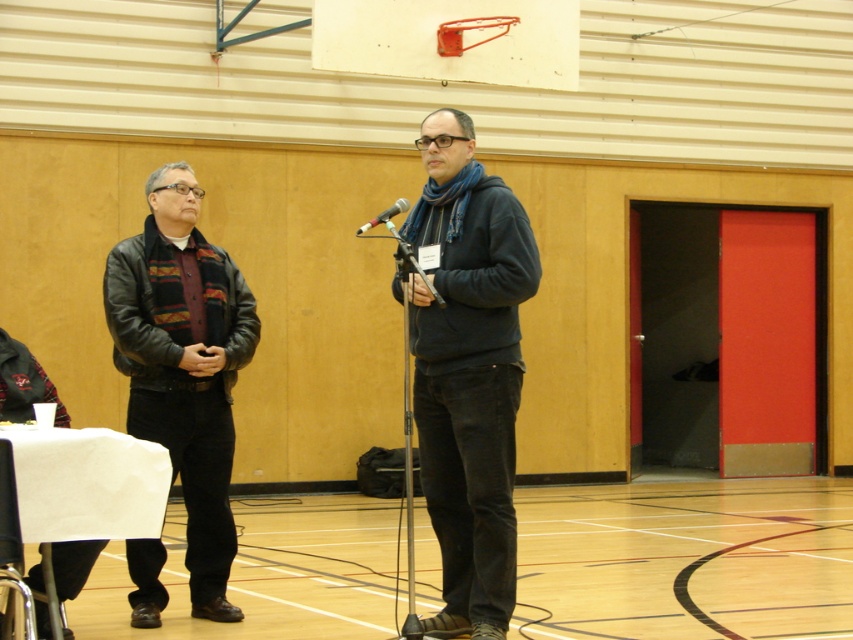
Question: Does wooden floor at center lie behind leather jacket at left?

Choices:
 (A) yes
 (B) no

Answer: (B)

Question: Which of the following is the closest to the observer?

Choices:
 (A) silver metallic microphone at center
 (B) leather jacket at left
 (C) dark gray hoodie at center
 (D) wooden floor at center

Answer: (C)

Question: In this image, where is wooden floor at center located relative to leather jacket at left?

Choices:
 (A) left
 (B) right

Answer: (B)

Question: Among these points, which one is nearest to the camera?

Choices:
 (A) (428, 627)
 (B) (398, 211)
 (C) (688, 576)

Answer: (A)

Question: Can you confirm if leather jacket at left is positioned to the left of silver metallic microphone at center?

Choices:
 (A) no
 (B) yes

Answer: (B)

Question: Which object appears farthest from the camera in this image?

Choices:
 (A) silver metallic microphone at center
 (B) dark gray hoodie at center
 (C) wooden floor at center
 (D) leather jacket at left

Answer: (D)